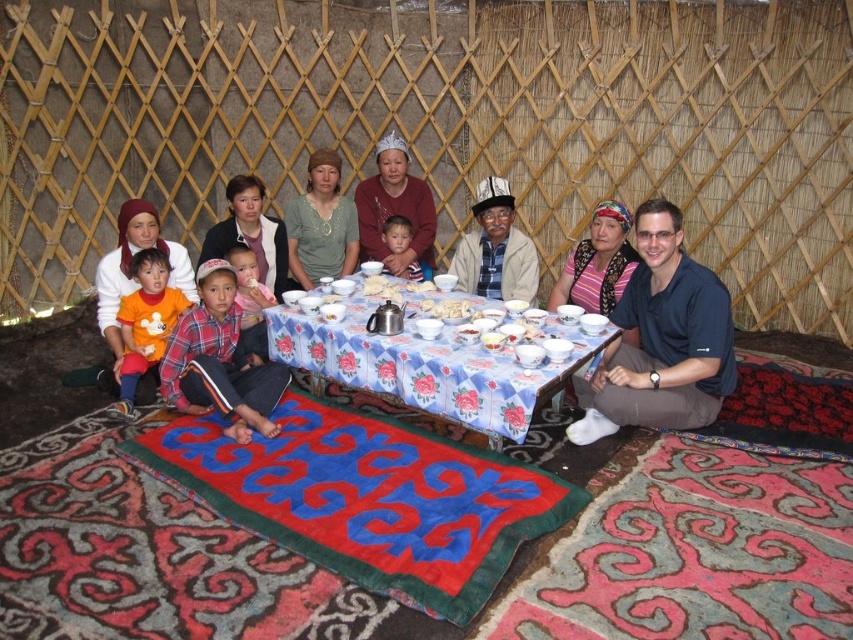
Question: Considering the relative positions of matte silver tiara at center and orange cotton shirt at lower left in the image provided, where is matte silver tiara at center located with respect to orange cotton shirt at lower left?

Choices:
 (A) left
 (B) right

Answer: (B)

Question: Observing the image, what is the correct spatial positioning of matte blue tablecloth at center in reference to smooth skin child at center?

Choices:
 (A) below
 (B) above

Answer: (A)

Question: Which point is farther from the camera taking this photo?

Choices:
 (A) (409, 180)
 (B) (723, 321)

Answer: (A)

Question: Which of these objects is positioned closest to the orange cotton shirt at lower left?

Choices:
 (A) blue shirt at center
 (B) matte blue tablecloth at center
 (C) blue floral tablecloth at center

Answer: (C)

Question: Which of these objects is positioned farthest from the matte blue tablecloth at center?

Choices:
 (A) blue floral tablecloth at center
 (B) matte silver tiara at center
 (C) orange cotton shirt at lower left

Answer: (C)

Question: Can you confirm if smooth skin child at center is positioned below white ceramic bowl at center?

Choices:
 (A) no
 (B) yes

Answer: (A)